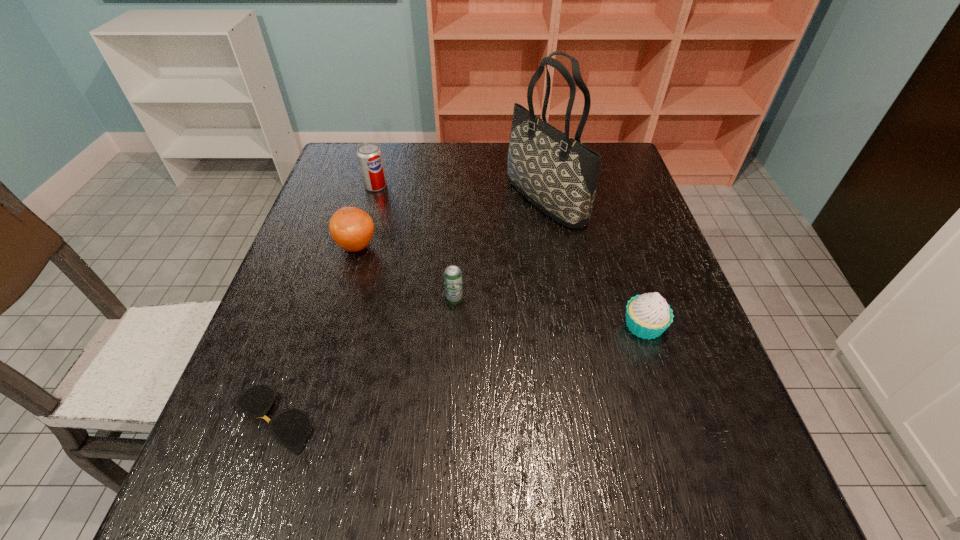
Where is `spectacles present at the left edge`? The image size is (960, 540). spectacles present at the left edge is located at coordinates (291, 428).

Where is `object present at the right edge`? object present at the right edge is located at coordinates (648, 315).

What are the coordinates of `object that is at the far left corner` in the screenshot? It's located at (369, 154).

This screenshot has height=540, width=960. Identify the location of free spot at the far edge of the desktop. (505, 176).

Identify the location of free space at the left edge of the desktop. (296, 324).

In the image, there is a desktop. Where is `vacant region at the right edge`? The image size is (960, 540). vacant region at the right edge is located at coordinates (756, 462).

You are a GUI agent. You are given a task and a screenshot of the screen. Output one action in this format:
    pyautogui.click(x=<x>, y=<y>)
    Task: Click on the vacant space at the far left corner of the desktop
    
    Given the screenshot: What is the action you would take?
    pyautogui.click(x=339, y=156)

This screenshot has height=540, width=960. I want to click on vacant area at the near left corner, so click(x=286, y=493).

In the image, there is a desktop. At what (x,y) coordinates should I click in order to perform the action: click on vacant space at the far right corner. Please return your answer as a coordinate pair (x, y). Looking at the image, I should click on (614, 147).

The width and height of the screenshot is (960, 540). Identify the location of empty space between the tote bag and the fourth nearest object. (451, 222).